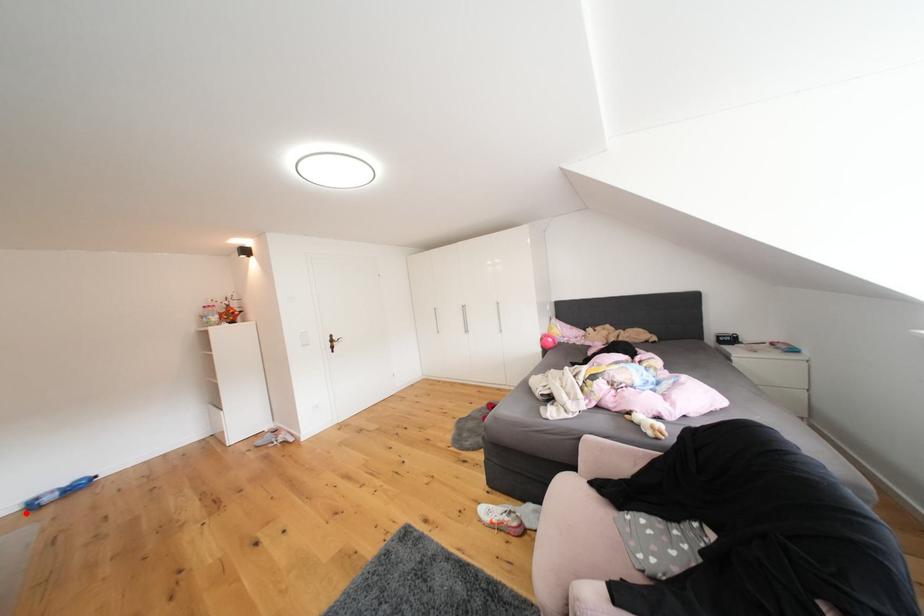
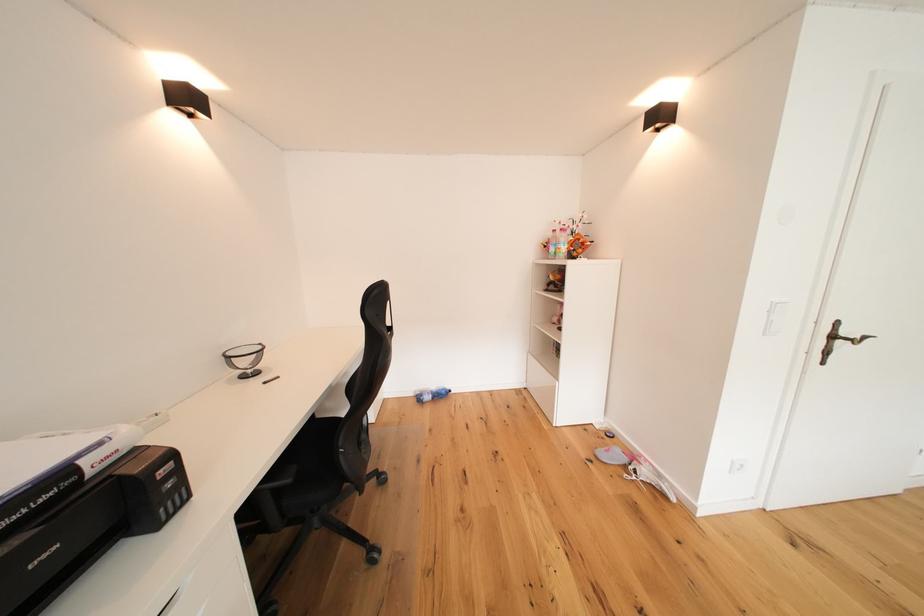
Question: I am providing you with two images of the same scene from different viewpoints. Given a red point in image1, look at the same physical point in image2. Is it:

Choices:
 (A) Closer to the viewpoint
 (B) Farther from the viewpoint

Answer: (A)